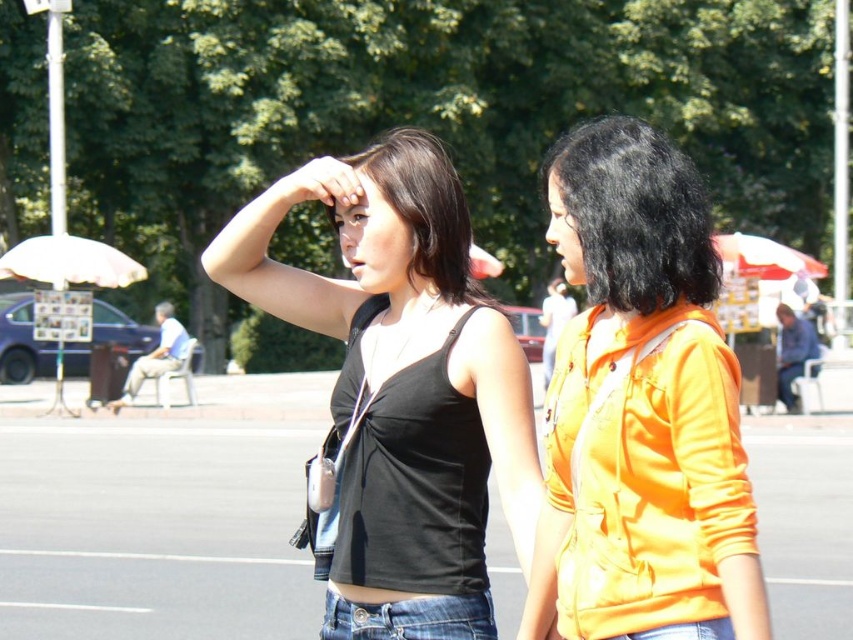
You are a photographer trying to capture a candid shot of the two people in the park. You notice the black smooth hair at center and the jeans at center. Which of these two features is wider in the image?

The black smooth hair at center is wider than the jeans at center.

You are a photographer trying to capture both individuals in a single frame. Given that the blue denim jeans at lower center and the jeans at center are part of their outfits, which pair of jeans would appear wider in the photo?

The blue denim jeans at lower center would appear wider in the photo because their width is larger than the jeans at center.